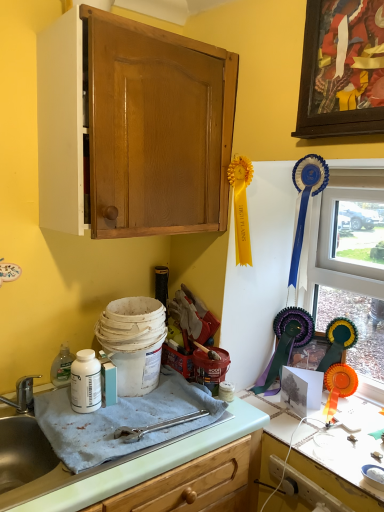
Question: Is white glossy countertop at lower right, which appears as the second countertop when viewed from the left, positioned beyond the bounds of wooden picture frame at upper right?

Choices:
 (A) yes
 (B) no

Answer: (A)

Question: Is white glossy countertop at lower right, which appears as the second countertop when viewed from the left, next to wooden picture frame at upper right?

Choices:
 (A) yes
 (B) no

Answer: (B)

Question: Is white glossy countertop at lower right, which appears as the second countertop when viewed from the left, at the left side of wooden picture frame at upper right?

Choices:
 (A) yes
 (B) no

Answer: (B)

Question: Is white glossy countertop at lower right, which appears as the second countertop when viewed from the left, smaller than wooden picture frame at upper right?

Choices:
 (A) no
 (B) yes

Answer: (B)

Question: Does white glossy countertop at lower right, which appears as the second countertop when viewed from the left, have a lesser height compared to wooden picture frame at upper right?

Choices:
 (A) no
 (B) yes

Answer: (B)

Question: Is white matte bottle at lower left to the left or to the right of white glossy countertop at lower right, positioned as the first countertop in right-to-left order, in the image?

Choices:
 (A) left
 (B) right

Answer: (A)

Question: Considering the positions of white matte bottle at lower left and white glossy countertop at lower right, positioned as the first countertop in right-to-left order, in the image, is white matte bottle at lower left wider or thinner than white glossy countertop at lower right, positioned as the first countertop in right-to-left order,?

Choices:
 (A) wide
 (B) thin

Answer: (B)

Question: Is white matte bottle at lower left taller or shorter than white glossy countertop at lower right, which appears as the second countertop when viewed from the left?

Choices:
 (A) tall
 (B) short

Answer: (A)

Question: From a real-world perspective, is white matte bottle at lower left positioned above or below white glossy countertop at lower right, which appears as the second countertop when viewed from the left?

Choices:
 (A) below
 (B) above

Answer: (B)

Question: From a real-world perspective, relative to white matte bottle at lower left, is wooden picture frame at upper right vertically above or below?

Choices:
 (A) above
 (B) below

Answer: (A)

Question: Looking at the image, does wooden picture frame at upper right seem bigger or smaller compared to white matte bottle at lower left?

Choices:
 (A) small
 (B) big

Answer: (B)

Question: Is wooden picture frame at upper right situated inside white matte bottle at lower left or outside?

Choices:
 (A) outside
 (B) inside

Answer: (A)

Question: From the image's perspective, is wooden picture frame at upper right located above or below white matte bottle at lower left?

Choices:
 (A) below
 (B) above

Answer: (B)

Question: Is point (147, 114) positioned closer to the camera than point (354, 20)?

Choices:
 (A) closer
 (B) farther

Answer: (B)

Question: Would you say matte wood cabinet at upper left is to the left or to the right of wooden picture frame at upper right in the picture?

Choices:
 (A) left
 (B) right

Answer: (A)